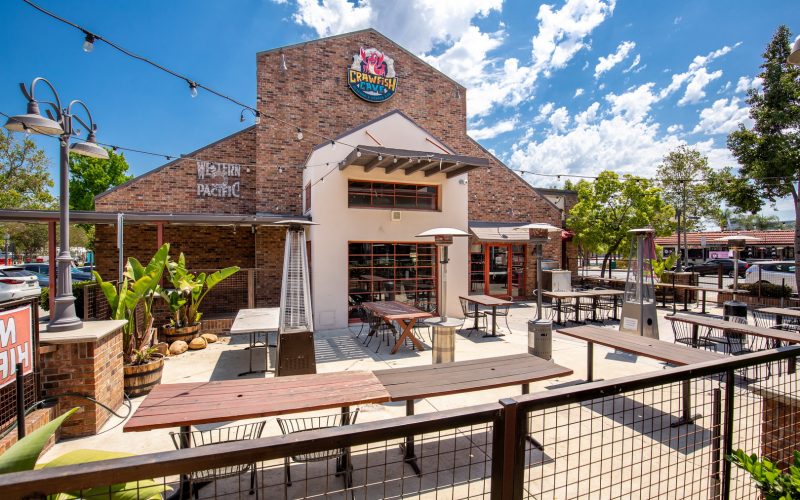
Image resolution: width=800 pixels, height=500 pixels. In order to click on bench in this screenshot , I will do `click(408, 376)`.